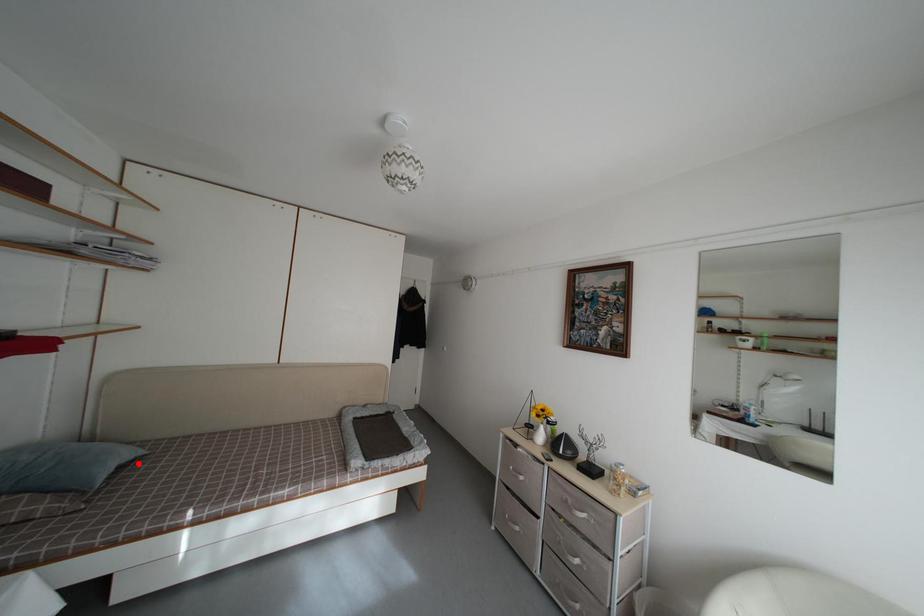
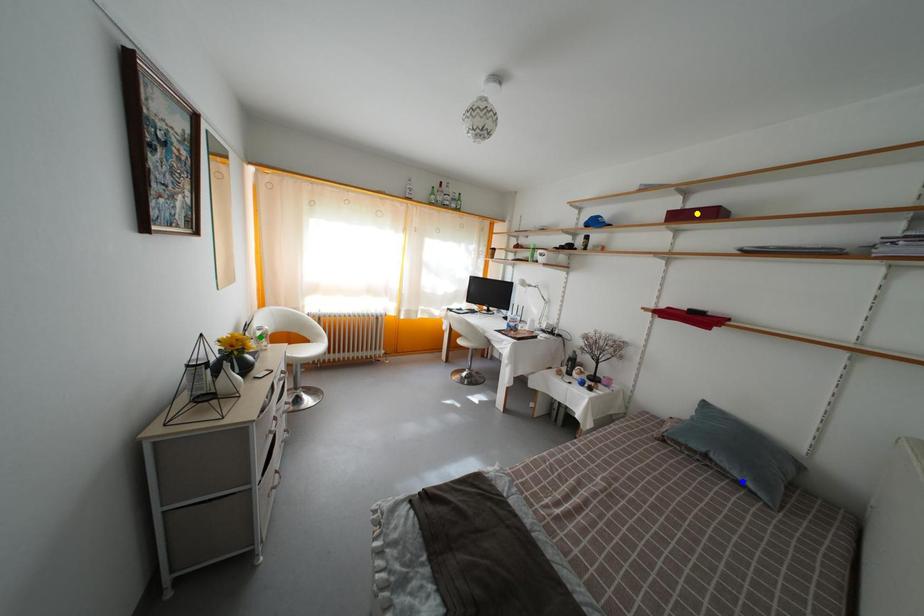
Question: I am providing you with two images of the same scene from different viewpoints. A red point is marked on the first image. You are given multiple points on the second image. Which mark in image 2 goes with the point in image 1?

Choices:
 (A) blue point
 (B) green point
 (C) yellow point

Answer: (A)